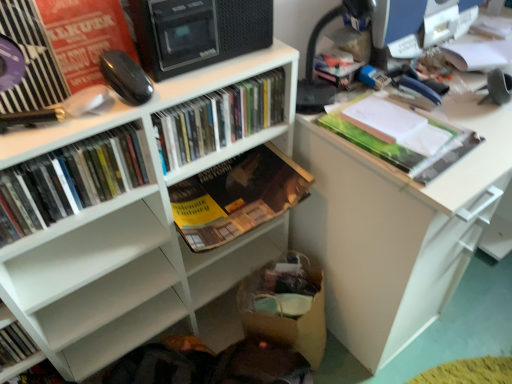
Question: Is matte plastic books at left, the 4th book viewed from the right, situated inside white matte bookcase at upper left or outside?

Choices:
 (A) outside
 (B) inside

Answer: (B)

Question: Is point (117, 167) positioned closer to the camera than point (148, 309)?

Choices:
 (A) closer
 (B) farther

Answer: (A)

Question: Based on their relative distances, which object is nearer to the hardcover book at center, the 4th book in the left-to-right sequence?

Choices:
 (A) white matte desk at center
 (B) matte plastic books at center, which is counted as the 3th book, starting from the right
 (C) hardcover book at lower left, positioned as the first book in left-to-right order
 (D) green matte folder at upper right, the 1th book positioned from the right
 (E) matte black monitor at upper right

Answer: (B)

Question: Which object is positioned closest to the matte plastic books at left, positioned as the second book in left-to-right order?

Choices:
 (A) black glossy mouse at upper left
 (B) green matte folder at upper right, the 1th book positioned from the right
 (C) matte black monitor at upper right
 (D) matte black shelf at upper left
 (E) white matte bookcase at upper left

Answer: (D)